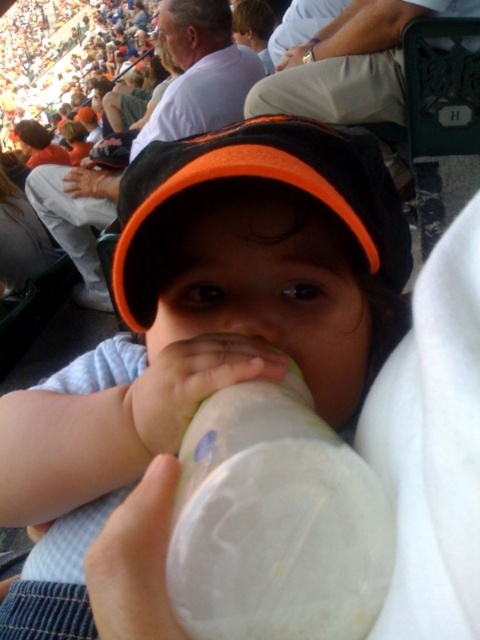
Question: Does white plastic bottle at center appear on the left side of transparent plastic bottle at center?

Choices:
 (A) yes
 (B) no

Answer: (A)

Question: Estimate the real-world distances between objects in this image. Which object is farther from the white plastic bottle at center?

Choices:
 (A) black fabric cap at center
 (B) transparent plastic bottle at center

Answer: (B)

Question: Among these objects, which one is nearest to the camera?

Choices:
 (A) white plastic bottle at center
 (B) transparent plastic bottle at center

Answer: (B)

Question: Among these points, which one is nearest to the camera?

Choices:
 (A) (162, 252)
 (B) (260, 579)

Answer: (B)

Question: Does transparent plastic bottle at center appear under black fabric cap at center?

Choices:
 (A) yes
 (B) no

Answer: (A)

Question: Does transparent plastic bottle at center have a greater width compared to black fabric cap at center?

Choices:
 (A) no
 (B) yes

Answer: (A)